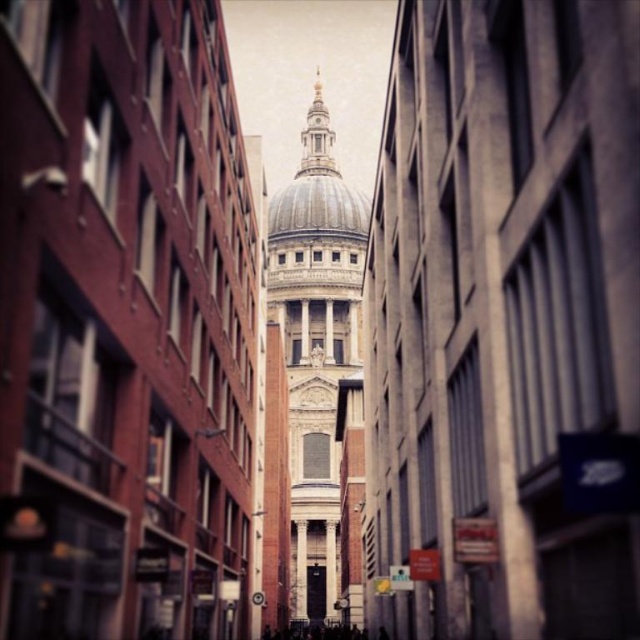
Question: Observing the image, what is the correct spatial positioning of white marble dome at center in reference to smooth stone dome at center?

Choices:
 (A) right
 (B) left

Answer: (B)

Question: Which point is closer to the camera?

Choices:
 (A) (273, 227)
 (B) (304, 225)

Answer: (B)

Question: Can you confirm if white marble tower at center is wider than white marble dome at center?

Choices:
 (A) no
 (B) yes

Answer: (A)

Question: Which of the following is the closest to the observer?

Choices:
 (A) white marble dome at center
 (B) smooth stone dome at center

Answer: (A)

Question: Considering the relative positions of white marble dome at center and smooth stone dome at center in the image provided, where is white marble dome at center located with respect to smooth stone dome at center?

Choices:
 (A) left
 (B) right

Answer: (A)

Question: Among these objects, which one is nearest to the camera?

Choices:
 (A) white marble dome at center
 (B) smooth stone dome at center
 (C) white marble tower at center

Answer: (C)